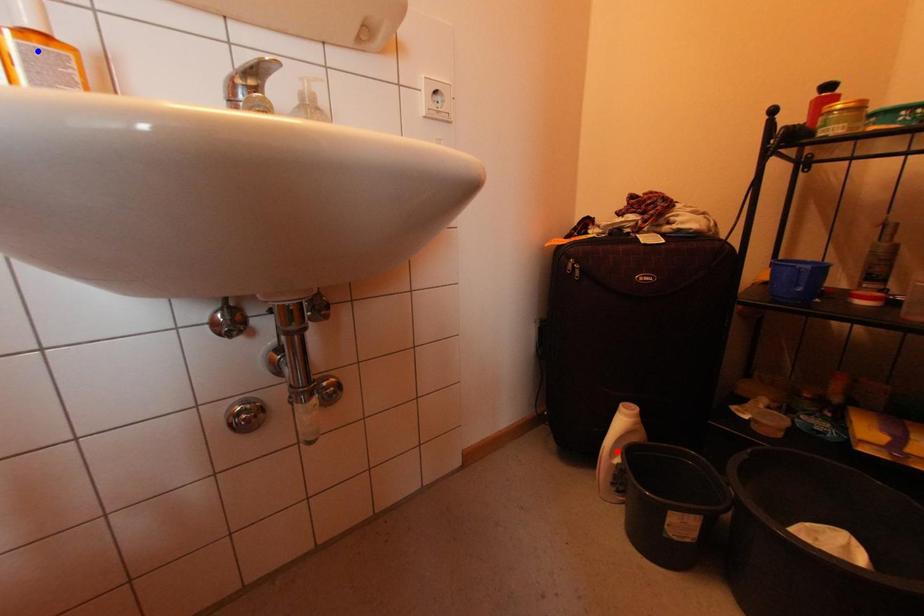
Question: Which of the two points in the image is closer to the camera?

Choices:
 (A) Blue point is closer.
 (B) Red point is closer.

Answer: (A)